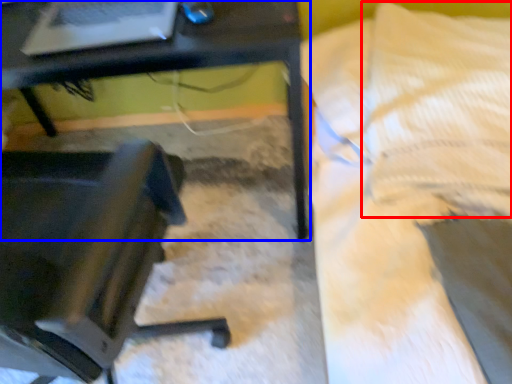
Question: Which object appears closest to the camera in this image, pillow (highlighted by a red box) or table (highlighted by a blue box)?

Choices:
 (A) pillow
 (B) table

Answer: (B)